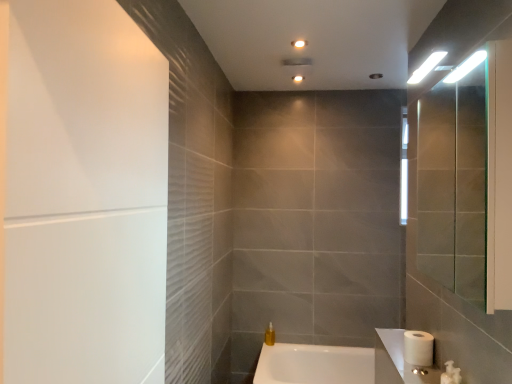
Question: Is white glossy sink at lower right looking in the opposite direction of white matte screen door at left?

Choices:
 (A) yes
 (B) no

Answer: (B)

Question: From the image's perspective, is white glossy sink at lower right above white matte screen door at left?

Choices:
 (A) no
 (B) yes

Answer: (A)

Question: Is white glossy sink at lower right positioned in front of white matte screen door at left?

Choices:
 (A) yes
 (B) no

Answer: (B)

Question: From a real-world perspective, is white glossy sink at lower right physically below white matte screen door at left?

Choices:
 (A) yes
 (B) no

Answer: (A)

Question: Is white glossy sink at lower right oriented towards white matte screen door at left?

Choices:
 (A) yes
 (B) no

Answer: (B)

Question: Can you confirm if white glossy sink at lower right is positioned to the right of white matte screen door at left?

Choices:
 (A) yes
 (B) no

Answer: (A)

Question: Would you say white matte toilet paper at lower right is outside white glossy bathtub at lower center?

Choices:
 (A) yes
 (B) no

Answer: (A)

Question: Can you confirm if white matte toilet paper at lower right is positioned to the left of white glossy bathtub at lower center?

Choices:
 (A) yes
 (B) no

Answer: (B)

Question: Does white matte toilet paper at lower right have a lesser width compared to white glossy bathtub at lower center?

Choices:
 (A) no
 (B) yes

Answer: (B)

Question: Is white matte toilet paper at lower right taller than white glossy bathtub at lower center?

Choices:
 (A) yes
 (B) no

Answer: (B)

Question: From the image's perspective, is white matte toilet paper at lower right under white glossy bathtub at lower center?

Choices:
 (A) yes
 (B) no

Answer: (B)

Question: Considering the relative sizes of white matte toilet paper at lower right and white glossy bathtub at lower center in the image provided, is white matte toilet paper at lower right wider than white glossy bathtub at lower center?

Choices:
 (A) yes
 (B) no

Answer: (B)

Question: Considering the relative sizes of matte white ceiling light at upper center and translucent yellow liquid at lower center in the image provided, is matte white ceiling light at upper center wider than translucent yellow liquid at lower center?

Choices:
 (A) yes
 (B) no

Answer: (A)